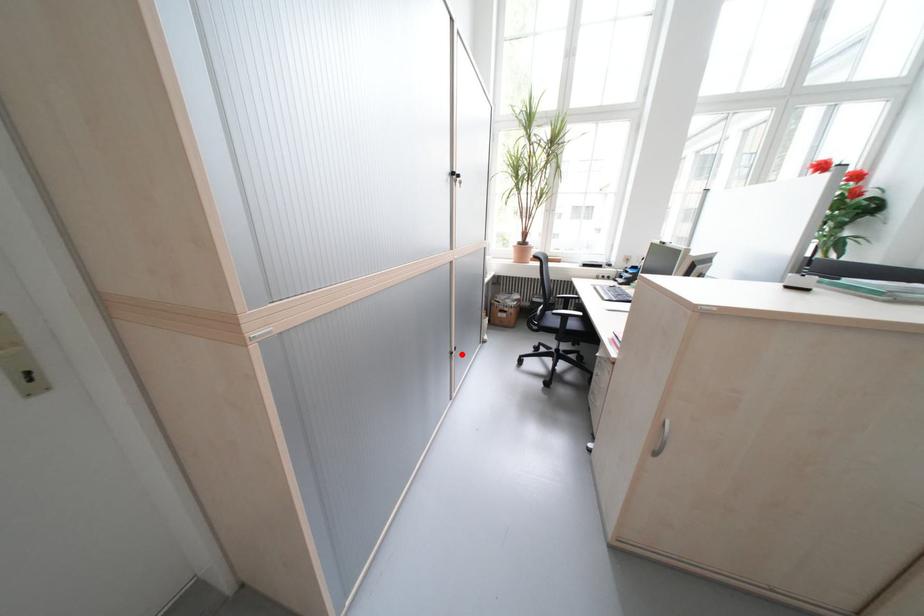
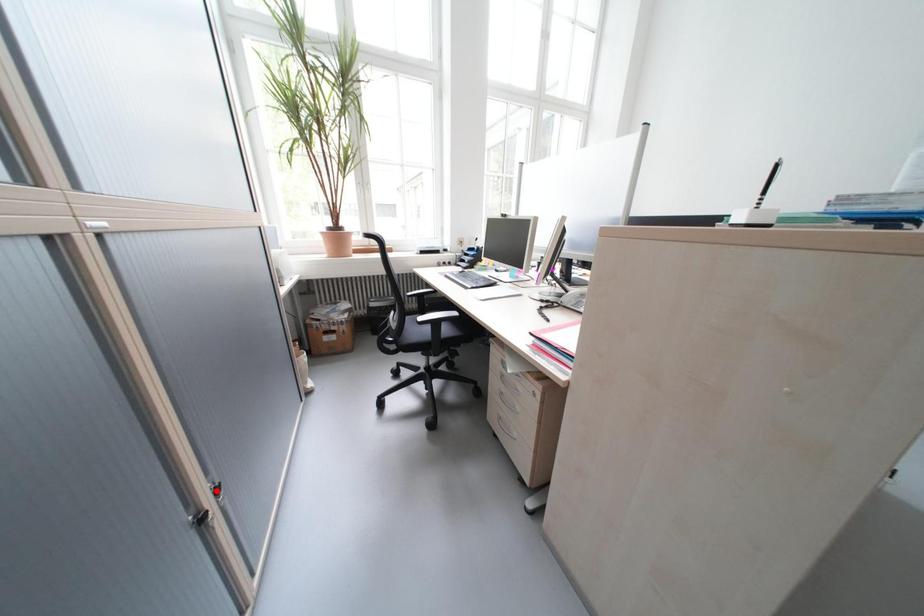
I am providing you with two images of the same scene from different viewpoints. A red point is marked on the first image and another point is marked on the second image. Does the point marked in image1 correspond to the same location as the one in image2?

No